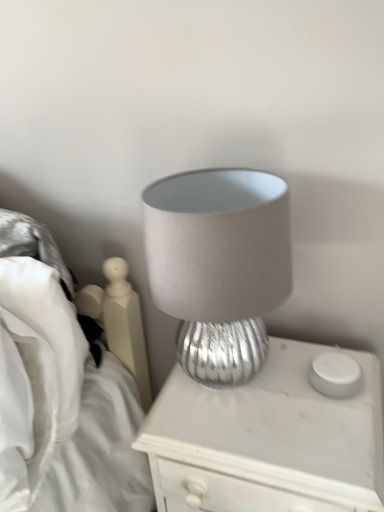
This screenshot has height=512, width=384. Find the location of `vacant space in between white matte candle holder at right and satin gray lampshade at center`. vacant space in between white matte candle holder at right and satin gray lampshade at center is located at coordinates (307, 390).